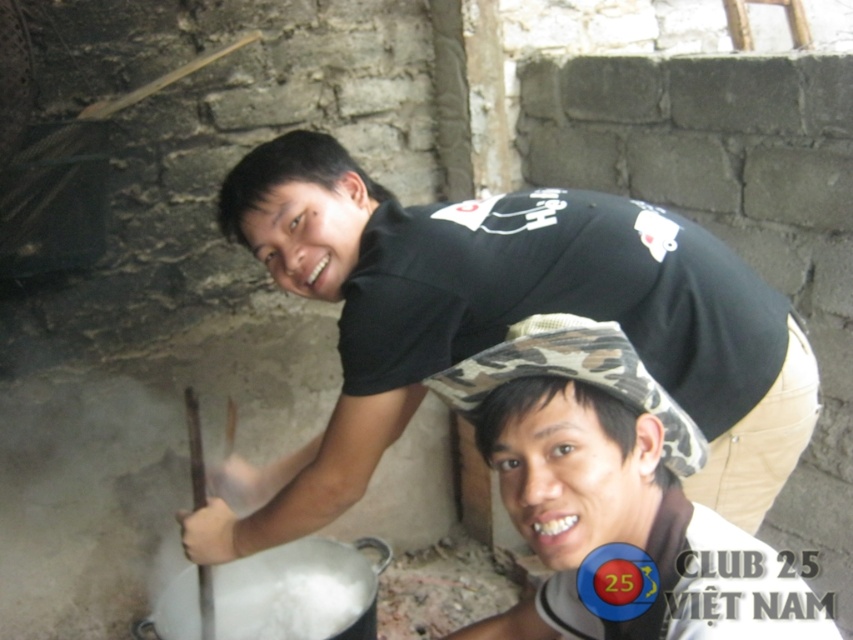
Who is more distant from viewer, (787, 397) or (764, 632)?

The point (787, 397) is behind.

Which is in front, point (723, 355) or point (589, 403)?

Point (589, 403) is more forward.

Does point (786, 346) lie behind point (527, 369)?

Yes, point (786, 346) is farther from viewer.

Find the location of `black matte shirt at upper center`. black matte shirt at upper center is located at coordinates (497, 324).